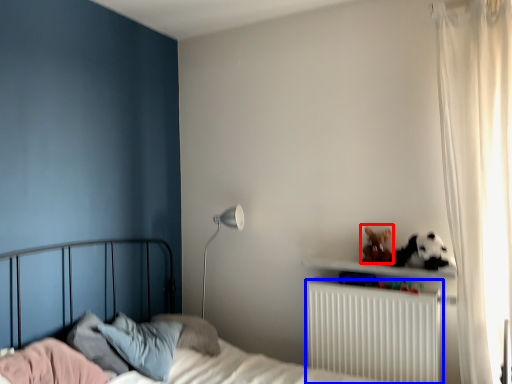
Question: Which object is further to the camera taking this photo, stuff (highlighted by a red box) or radiator (highlighted by a blue box)?

Choices:
 (A) stuff
 (B) radiator

Answer: (A)